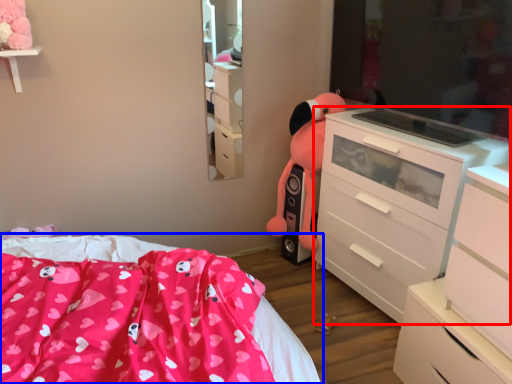
Question: Among these objects, which one is farthest to the camera, chest of drawers (highlighted by a red box) or bed (highlighted by a blue box)?

Choices:
 (A) chest of drawers
 (B) bed

Answer: (A)